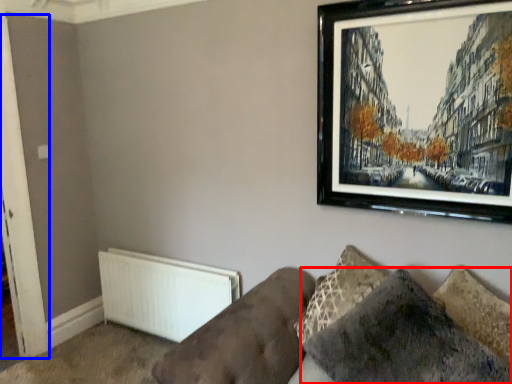
Question: Which object is further to the camera taking this photo, pillow (highlighted by a red box) or door (highlighted by a blue box)?

Choices:
 (A) pillow
 (B) door

Answer: (B)